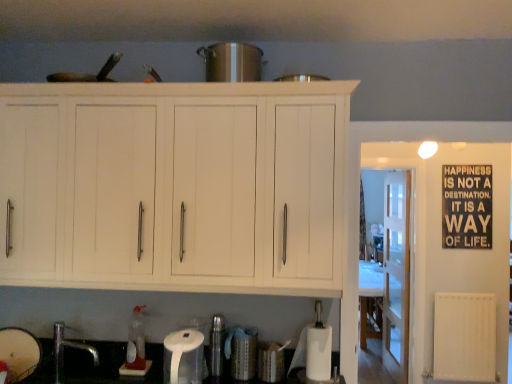
Question: Is black matte signboard at upper right located within shiny metallic pot at center, marked as the 3th appliance in a left-to-right arrangement?

Choices:
 (A) yes
 (B) no

Answer: (B)

Question: Does shiny metallic pot at center, positioned as the fourth appliance in bottom-to-top order, have a larger size compared to black matte signboard at upper right?

Choices:
 (A) no
 (B) yes

Answer: (B)

Question: From a real-world perspective, is shiny metallic pot at center, positioned as the fourth appliance in bottom-to-top order, positioned over black matte signboard at upper right based on gravity?

Choices:
 (A) no
 (B) yes

Answer: (B)

Question: Is shiny metallic pot at center, positioned as the fourth appliance in bottom-to-top order, beside black matte signboard at upper right?

Choices:
 (A) no
 (B) yes

Answer: (A)

Question: Could you tell me if shiny metallic pot at center, marked as the 3th appliance in a left-to-right arrangement, is turned towards black matte signboard at upper right?

Choices:
 (A) no
 (B) yes

Answer: (A)

Question: Based on their positions, is white plastic radiator at right located to the left or right of white matte paper towel at lower center?

Choices:
 (A) right
 (B) left

Answer: (A)

Question: Considering the positions of white plastic radiator at right and white matte paper towel at lower center in the image, is white plastic radiator at right taller or shorter than white matte paper towel at lower center?

Choices:
 (A) short
 (B) tall

Answer: (B)

Question: Considering the positions of point (474, 299) and point (180, 360), is point (474, 299) closer or farther from the camera than point (180, 360)?

Choices:
 (A) closer
 (B) farther

Answer: (B)

Question: Based on their sizes in the image, would you say white plastic radiator at right is bigger or smaller than white matte paper towel at lower center?

Choices:
 (A) small
 (B) big

Answer: (B)

Question: In the image, is metallic silver canister at lower center, which is counted as the 2th appliance, starting from the left, on the left side or the right side of shiny metallic pot at center, marked as the 2th appliance in a right-to-left arrangement?

Choices:
 (A) right
 (B) left

Answer: (B)

Question: From the image's perspective, is metallic silver canister at lower center, which appears as the third appliance when viewed from the right, above or below shiny metallic pot at center, marked as the 3th appliance in a left-to-right arrangement?

Choices:
 (A) below
 (B) above

Answer: (A)

Question: From a real-world perspective, relative to shiny metallic pot at center, marked as the 2th appliance in a right-to-left arrangement, is metallic silver canister at lower center, which is counted as the 2th appliance, starting from the left, vertically above or below?

Choices:
 (A) below
 (B) above

Answer: (A)

Question: Is point (208, 355) closer or farther from the camera than point (244, 66)?

Choices:
 (A) closer
 (B) farther

Answer: (B)

Question: Choose the correct answer: Is matte white bowl at lower left, the second appliance from the bottom, inside metallic silver canister at lower center, which appears as the third appliance when viewed from the right, or outside it?

Choices:
 (A) outside
 (B) inside

Answer: (A)

Question: Is matte white bowl at lower left, the second appliance from the bottom, bigger or smaller than metallic silver canister at lower center, positioned as the 2th appliance in top-to-bottom order?

Choices:
 (A) big
 (B) small

Answer: (A)